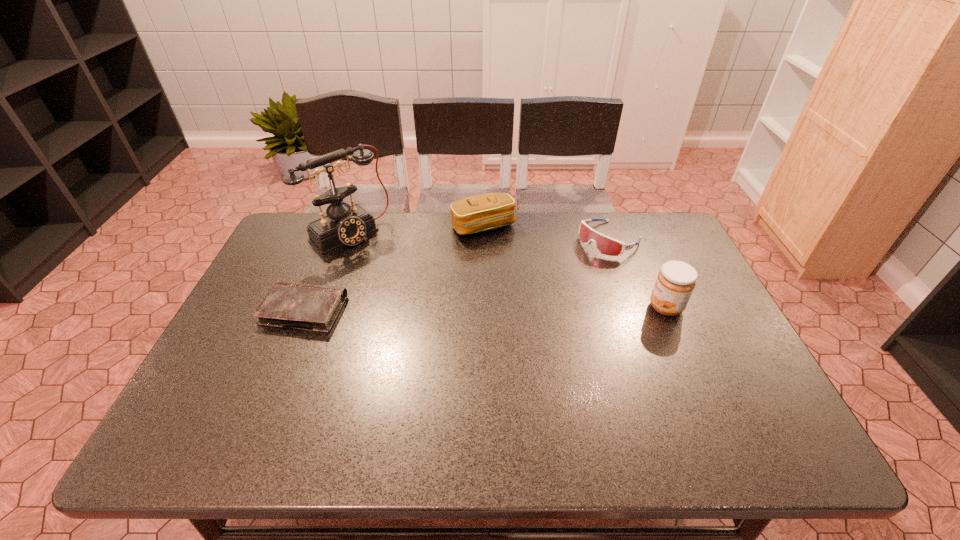
Find the location of `telephone that is at the far edge`. telephone that is at the far edge is located at coordinates (348, 225).

At what (x,y) coordinates should I click in order to perform the action: click on clutch bag located in the far edge section of the desktop. Please return your answer as a coordinate pair (x, y). This screenshot has width=960, height=540. Looking at the image, I should click on (483, 212).

Where is `diary that is at the left edge`? The image size is (960, 540). diary that is at the left edge is located at coordinates (309, 307).

You are a GUI agent. You are given a task and a screenshot of the screen. Output one action in this format:
    pyautogui.click(x=<x>, y=<y>)
    Task: Click on the telephone that is at the left edge
    This screenshot has height=540, width=960.
    Given the screenshot: What is the action you would take?
    pyautogui.click(x=348, y=225)

Find the location of `jam located at the right edge`. jam located at the right edge is located at coordinates (676, 280).

Where is `goggles that is at the right edge`? The width and height of the screenshot is (960, 540). goggles that is at the right edge is located at coordinates (605, 245).

Find the location of a particular element. The image size is (960, 540). object present at the far left corner is located at coordinates (348, 225).

The image size is (960, 540). Identify the location of object that is at the far right corner. (605, 245).

You are a GUI agent. You are given a task and a screenshot of the screen. Output one action in this format:
    pyautogui.click(x=<x>, y=<y>)
    Task: Click on the free location at the far edge of the desktop
    This screenshot has width=960, height=540.
    Given the screenshot: What is the action you would take?
    tap(352, 249)

Find the location of a particular element. The height and width of the screenshot is (540, 960). free space at the near edge is located at coordinates (336, 410).